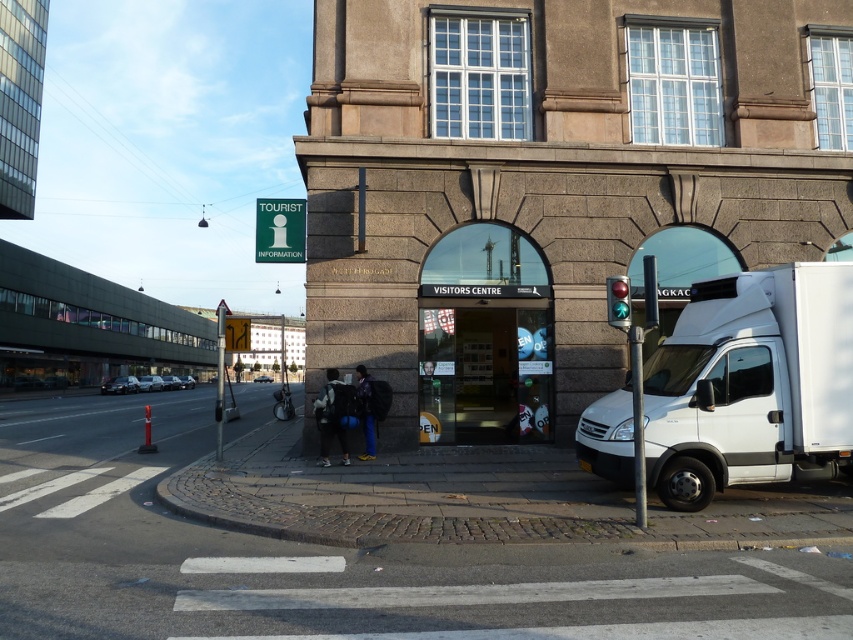
You are standing at the entrance of the Visitors Centre and want to hail a taxi. The taxi stand is located at the point with coordinates closest to the white matte truck at right. What are the coordinates of the taxi stand?

The coordinates of the taxi stand are at point [752,384], same as the white matte truck at right.

You are standing on the sidewalk in front of the Visitors Centre. You see the white matte truck at right. If you start walking towards it at a speed of 1.5 meters per second, how many seconds will it take you to reach the truck?

The distance between the white matte truck at right and the viewer is 8.82 meters. At a speed of 1.5 meters per second, it would take 8.82 divided by 1.5, which equals approximately 5.88 seconds to reach the truck.

You are a tourist standing at the pedestrian crossing in front of the Visitors Centre. You see the white matte truck at right and the metallic reflective traffic light at right. Which object is closer to the Visitors Centre entrance?

The metallic reflective traffic light at right is closer to the Visitors Centre entrance because the white matte truck at right is to the right of it.